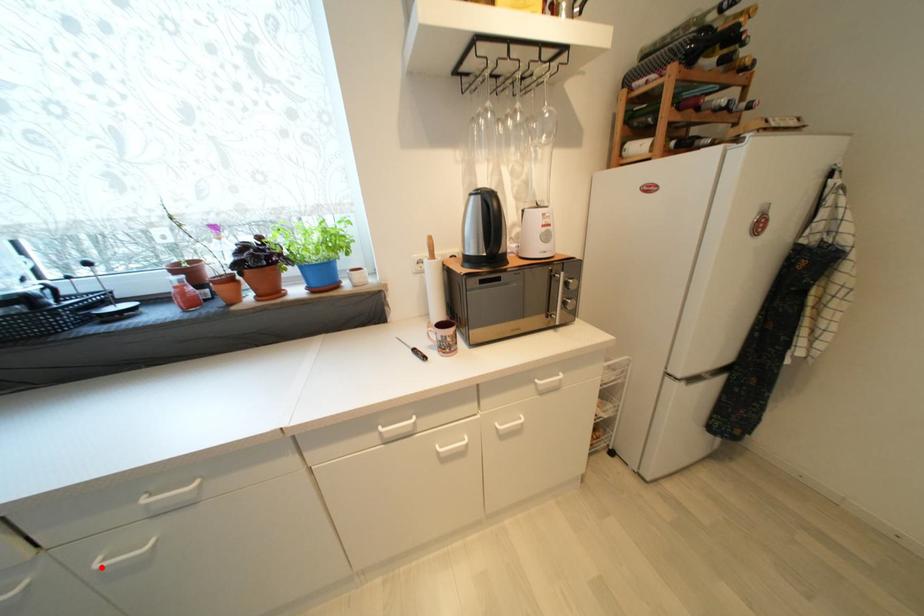
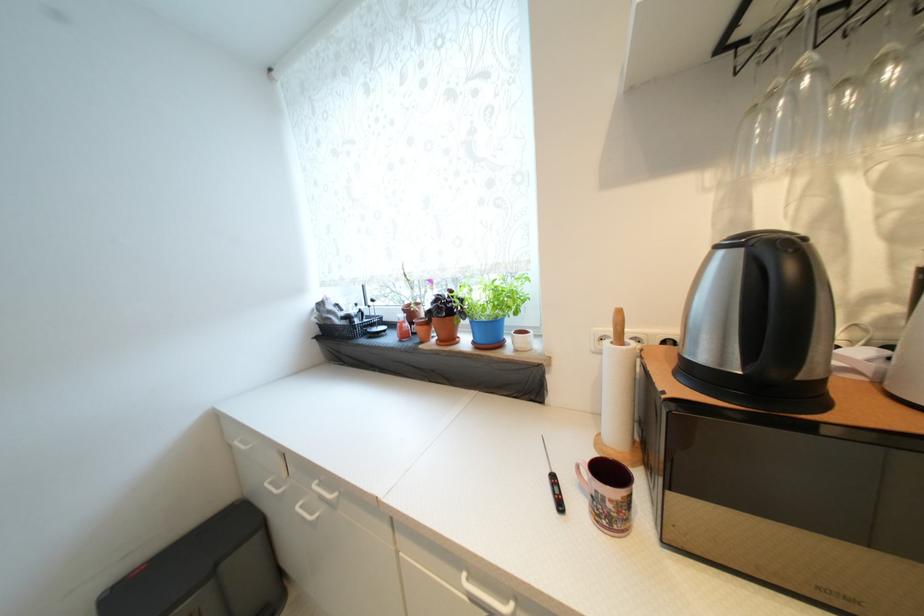
Question: I am providing you with two images of the same scene from different viewpoints. In image1, a red point is highlighted. Considering the same 3D point in image2, which of the following is correct?

Choices:
 (A) It is closer
 (B) It is farther

Answer: (B)